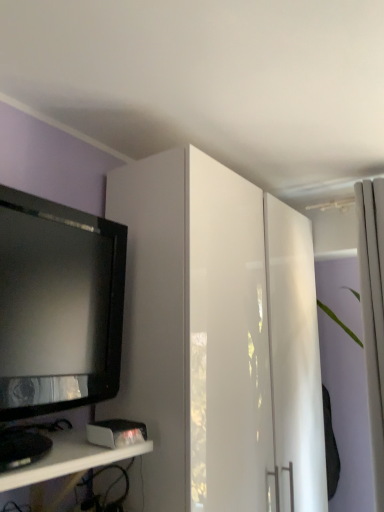
Question: Is point (246, 429) closer or farther from the camera than point (29, 232)?

Choices:
 (A) farther
 (B) closer

Answer: (A)

Question: Is white glossy cabinet at upper center wider or thinner than black glossy television at left?

Choices:
 (A) wide
 (B) thin

Answer: (A)

Question: Based on their relative distances, which object is farther from the black glossy television at left?

Choices:
 (A) white glossy cabinet at upper center
 (B) white glossy shelf at lower left
 (C) white fabric curtain at right

Answer: (C)

Question: Which is farther from the white glossy cabinet at upper center?

Choices:
 (A) white glossy shelf at lower left
 (B) white fabric curtain at right
 (C) black glossy television at left

Answer: (B)